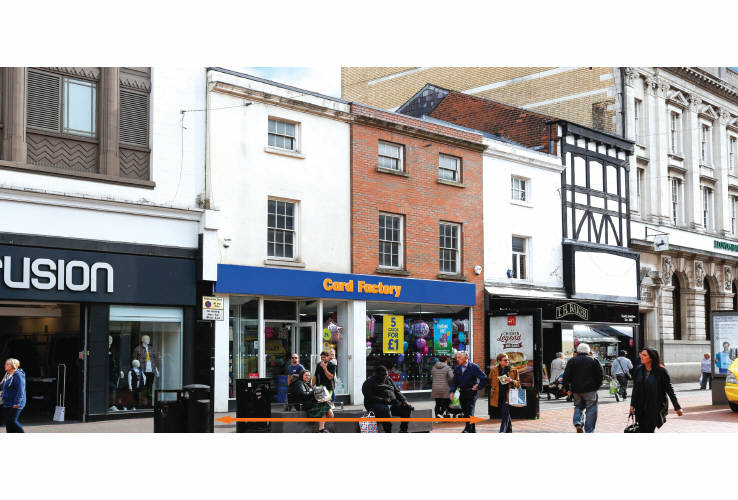
Locate an element on the screen. Image resolution: width=738 pixels, height=500 pixels. window is located at coordinates (672, 203), (679, 144), (730, 153), (705, 213), (516, 252), (446, 251), (393, 246), (288, 238).